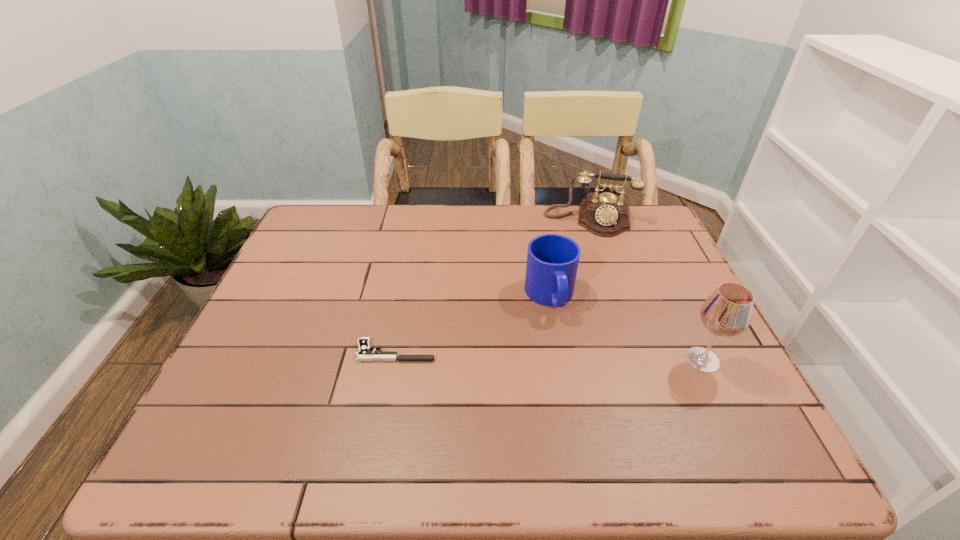
At what (x,y) coordinates should I click in order to perform the action: click on free spot between the telephone and the leftmost object. Please return your answer as a coordinate pair (x, y). Looking at the image, I should click on (492, 286).

Where is `free space between the pistol and the second tallest object`? The width and height of the screenshot is (960, 540). free space between the pistol and the second tallest object is located at coordinates (492, 286).

At what (x,y) coordinates should I click in order to perform the action: click on free space between the shortest object and the tallest object. Please return your answer as a coordinate pair (x, y). This screenshot has height=540, width=960. Looking at the image, I should click on (549, 356).

At what (x,y) coordinates should I click in order to perform the action: click on free spot between the tallest object and the telephone. Please return your answer as a coordinate pair (x, y). Looking at the image, I should click on click(646, 290).

Identify which object is the closest to the leftmost object. Please provide its 2D coordinates. Your answer should be formatted as a tuple, i.e. [(x, y)], where the tuple contains the x and y coordinates of a point satisfying the conditions above.

[(552, 260)]

The image size is (960, 540). In order to click on the second closest object relative to the mug in this screenshot , I will do `click(727, 312)`.

Identify the location of vacant space that satisfies the following two spatial constraints: 1. on the front side of the tallest object; 2. on the right side of the mug. (561, 360).

Identify the location of free spot that satisfies the following two spatial constraints: 1. on the back side of the mug; 2. on the left side of the farthest object. [537, 220].